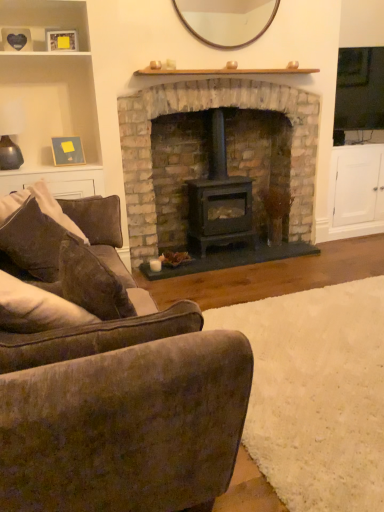
Locate an element on the screen. blank space situated above velvety brown armchair at lower left (from a real-world perspective) is located at coordinates (325, 365).